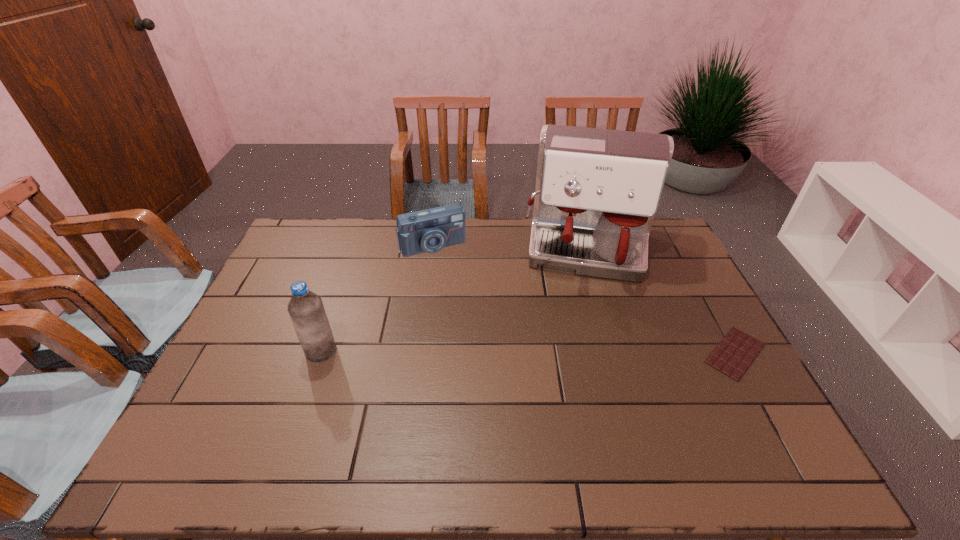
Find the location of a particular element. Image resolution: width=960 pixels, height=540 pixels. free space on the desktop that is between the second tallest object and the shortest object and is positioned on the lens of the third tallest object is located at coordinates (485, 352).

At what (x,y) coordinates should I click in order to perform the action: click on vacant space on the desktop that is between the water bottle and the chocolate bar and is positioned on the front of the coffee maker near the spout. Please return your answer as a coordinate pair (x, y). The image size is (960, 540). Looking at the image, I should click on (581, 352).